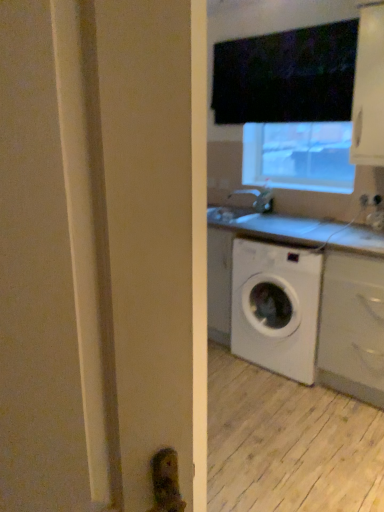
What is the approximate width of white plastic electric outlet at upper right?

0.64 inches.

What do you see at coordinates (369, 89) in the screenshot?
I see `white glossy cabinet at upper right, the first cabinetry positioned from the top` at bounding box center [369, 89].

What do you see at coordinates (352, 315) in the screenshot? Image resolution: width=384 pixels, height=512 pixels. I see `white glossy counter at center` at bounding box center [352, 315].

Measure the distance between point [352,339] and camera.

Point [352,339] is 2.39 meters from camera.

Describe the element at coordinates (258, 198) in the screenshot. I see `matte silver faucet at center` at that location.

The image size is (384, 512). I want to click on white plastic electric outlet at upper right, so click(x=370, y=200).

Looking at their sizes, would you say white plastic electric outlet at upper right is wider or thinner than white matte cabinet at lower right, the 2th cabinetry from the top?

In the image, white plastic electric outlet at upper right appears to be more narrow than white matte cabinet at lower right, the 2th cabinetry from the top.

Is white plastic electric outlet at upper right placed right next to white matte cabinet at lower right, the 2th cabinetry from the top?

No, white plastic electric outlet at upper right is not with white matte cabinet at lower right, the 2th cabinetry from the top.

Relative to white matte cabinet at lower right, the 2th cabinetry from the top, is white plastic electric outlet at upper right in front or behind?

Clearly, white plastic electric outlet at upper right is behind white matte cabinet at lower right, the 2th cabinetry from the top.

Would you say white plastic electric outlet at upper right contains white matte cabinet at lower right, the 2th cabinetry from the top?

No, white matte cabinet at lower right, the 2th cabinetry from the top, is not inside white plastic electric outlet at upper right.

Between point (376, 196) and point (363, 73), which one is positioned in front?

Point (363, 73)

Considering the sizes of white plastic electric outlet at upper right and white glossy cabinet at upper right, the second cabinetry positioned from the bottom, in the image, is white plastic electric outlet at upper right bigger or smaller than white glossy cabinet at upper right, the second cabinetry positioned from the bottom,?

white plastic electric outlet at upper right is smaller than white glossy cabinet at upper right, the second cabinetry positioned from the bottom.

Who is shorter, white plastic electric outlet at upper right or white glossy cabinet at upper right, the second cabinetry positioned from the bottom?

With less height is white plastic electric outlet at upper right.

Would you say white plastic electric outlet at upper right is inside or outside white glossy cabinet at upper right, the first cabinetry positioned from the top?

white plastic electric outlet at upper right is spatially situated outside white glossy cabinet at upper right, the first cabinetry positioned from the top.

Is white glossy cabinet at upper right, the second cabinetry positioned from the bottom, at the left side of white glossy counter at center?

No, white glossy cabinet at upper right, the second cabinetry positioned from the bottom, is not to the left of white glossy counter at center.

Between white glossy cabinet at upper right, the second cabinetry positioned from the bottom, and white glossy counter at center, which one has more height?

white glossy counter at center.

From a real-world perspective, does white glossy cabinet at upper right, the first cabinetry positioned from the top, stand above white glossy counter at center?

Correct, in the physical world, white glossy cabinet at upper right, the first cabinetry positioned from the top, is higher than white glossy counter at center.

Is white glossy cabinet at upper right, the first cabinetry positioned from the top, beside white glossy counter at center?

There is a gap between white glossy cabinet at upper right, the first cabinetry positioned from the top, and white glossy counter at center.

What's the angular difference between matte silver faucet at center and white matte cabinet at lower right, positioned as the first cabinetry in bottom-to-top order,'s facing directions?

The facing directions of matte silver faucet at center and white matte cabinet at lower right, positioned as the first cabinetry in bottom-to-top order, are 0.419 degrees apart.

From a real-world perspective, which is physically above, matte silver faucet at center or white matte cabinet at lower right, positioned as the first cabinetry in bottom-to-top order?

From a 3D spatial view, matte silver faucet at center is above.

From the picture: Measure the distance between matte silver faucet at center and white matte cabinet at lower right, positioned as the first cabinetry in bottom-to-top order.

1.15 meters.

Is matte silver faucet at center positioned before white matte cabinet at lower right, positioned as the first cabinetry in bottom-to-top order?

No, it is behind white matte cabinet at lower right, positioned as the first cabinetry in bottom-to-top order.

Which is in front, white glossy counter at center or white glossy cabinet at upper right, the first cabinetry positioned from the top?

white glossy cabinet at upper right, the first cabinetry positioned from the top, is in front.

Does white glossy counter at center have a greater width compared to white glossy cabinet at upper right, the first cabinetry positioned from the top?

Yes, white glossy counter at center is wider than white glossy cabinet at upper right, the first cabinetry positioned from the top.

Would you say white glossy counter at center is inside or outside white glossy cabinet at upper right, the second cabinetry positioned from the bottom?

white glossy counter at center is not inside white glossy cabinet at upper right, the second cabinetry positioned from the bottom, it's outside.

Is white glossy counter at center next to white glossy cabinet at upper right, the second cabinetry positioned from the bottom?

white glossy counter at center is not next to white glossy cabinet at upper right, the second cabinetry positioned from the bottom, and they're not touching.

Which is more to the right, white plastic electric outlet at upper right or white glossy counter at center?

white plastic electric outlet at upper right is more to the right.

Is white plastic electric outlet at upper right looking in the opposite direction of white glossy counter at center?

No, white glossy counter at center is not at the back of white plastic electric outlet at upper right.

From a real-world perspective, does white plastic electric outlet at upper right sit lower than white glossy counter at center?

No, from a real-world perspective, white plastic electric outlet at upper right is not below white glossy counter at center.

In the scene shown: Is white plastic electric outlet at upper right spatially inside white glossy counter at center, or outside of it?

white plastic electric outlet at upper right is outside white glossy counter at center.

From the image's perspective, which one is positioned lower, white matte cabinet at lower right, the 2th cabinetry from the top, or white glossy cabinet at upper right, the second cabinetry positioned from the bottom?

white matte cabinet at lower right, the 2th cabinetry from the top, from the image's perspective.

The image size is (384, 512). I want to click on cabinetry that is in front of the white matte cabinet at lower right, positioned as the first cabinetry in bottom-to-top order, so (369, 89).

In terms of height, does white matte cabinet at lower right, positioned as the first cabinetry in bottom-to-top order, look taller or shorter compared to white glossy cabinet at upper right, the second cabinetry positioned from the bottom?

Clearly, white matte cabinet at lower right, positioned as the first cabinetry in bottom-to-top order, is taller compared to white glossy cabinet at upper right, the second cabinetry positioned from the bottom.

Considering the relative positions of white matte cabinet at lower right, the 2th cabinetry from the top, and white glossy cabinet at upper right, the first cabinetry positioned from the top, in the image provided, is white matte cabinet at lower right, the 2th cabinetry from the top, to the left of white glossy cabinet at upper right, the first cabinetry positioned from the top, from the viewer's perspective?

Incorrect, white matte cabinet at lower right, the 2th cabinetry from the top, is not on the left side of white glossy cabinet at upper right, the first cabinetry positioned from the top.

The image size is (384, 512). Identify the location of the 1st cabinetry to the left when counting from the white plastic electric outlet at upper right. (352, 327).

The width and height of the screenshot is (384, 512). Find the location of `electric outlet below the white glossy cabinet at upper right, the first cabinetry positioned from the top (from a real-world perspective)`. electric outlet below the white glossy cabinet at upper right, the first cabinetry positioned from the top (from a real-world perspective) is located at coordinates (370, 200).

Which object lies further to the anchor point white plastic electric outlet at upper right, white glossy cabinet at upper right, the first cabinetry positioned from the top, or white matte cabinet at lower right, positioned as the first cabinetry in bottom-to-top order?

Based on the image, white matte cabinet at lower right, positioned as the first cabinetry in bottom-to-top order, appears to be further to white plastic electric outlet at upper right.

Looking at the image, which one is located further to white glossy counter at center, white glossy cabinet at upper right, the first cabinetry positioned from the top, or white matte cabinet at lower right, positioned as the first cabinetry in bottom-to-top order?

white glossy cabinet at upper right, the first cabinetry positioned from the top, lies further to white glossy counter at center than the other object.

Which object lies further to the anchor point white matte cabinet at lower right, positioned as the first cabinetry in bottom-to-top order, white glossy counter at center or matte silver faucet at center?

matte silver faucet at center is further to white matte cabinet at lower right, positioned as the first cabinetry in bottom-to-top order.

Estimate the real-world distances between objects in this image. Which object is closer to white glossy cabinet at upper right, the first cabinetry positioned from the top, matte silver faucet at center or white plastic electric outlet at upper right?

white plastic electric outlet at upper right is positioned closer to the anchor white glossy cabinet at upper right, the first cabinetry positioned from the top.

Considering their positions, is white glossy counter at center positioned closer to white plastic electric outlet at upper right than white matte cabinet at lower right, positioned as the first cabinetry in bottom-to-top order?

Among the two, white matte cabinet at lower right, positioned as the first cabinetry in bottom-to-top order, is located nearer to white plastic electric outlet at upper right.

Estimate the real-world distances between objects in this image. Which object is further from white matte cabinet at lower right, the 2th cabinetry from the top, white glossy cabinet at upper right, the second cabinetry positioned from the bottom, or matte silver faucet at center?

matte silver faucet at center is further to white matte cabinet at lower right, the 2th cabinetry from the top.

Looking at the image, which one is located closer to white plastic electric outlet at upper right, white glossy counter at center or white glossy cabinet at upper right, the second cabinetry positioned from the bottom?

Based on the image, white glossy cabinet at upper right, the second cabinetry positioned from the bottom, appears to be nearer to white plastic electric outlet at upper right.

Which object lies nearer to the anchor point white glossy cabinet at upper right, the second cabinetry positioned from the bottom, white glossy counter at center or white plastic electric outlet at upper right?

Among the two, white plastic electric outlet at upper right is located nearer to white glossy cabinet at upper right, the second cabinetry positioned from the bottom.

The height and width of the screenshot is (512, 384). In order to click on counter between white glossy cabinet at upper right, the second cabinetry positioned from the bottom, and white matte cabinet at lower right, the 2th cabinetry from the top, from top to bottom in this screenshot , I will do `click(352, 315)`.

Find the location of a particular element. This screenshot has height=512, width=384. faucet between white glossy cabinet at upper right, the first cabinetry positioned from the top, and white matte cabinet at lower right, positioned as the first cabinetry in bottom-to-top order, from top to bottom is located at coordinates (258, 198).

The image size is (384, 512). Identify the location of electric outlet that lies between white glossy cabinet at upper right, the first cabinetry positioned from the top, and white glossy counter at center from top to bottom. (370, 200).

The image size is (384, 512). What are the coordinates of `faucet between white glossy cabinet at upper right, the first cabinetry positioned from the top, and white glossy counter at center from top to bottom` in the screenshot? It's located at (258, 198).